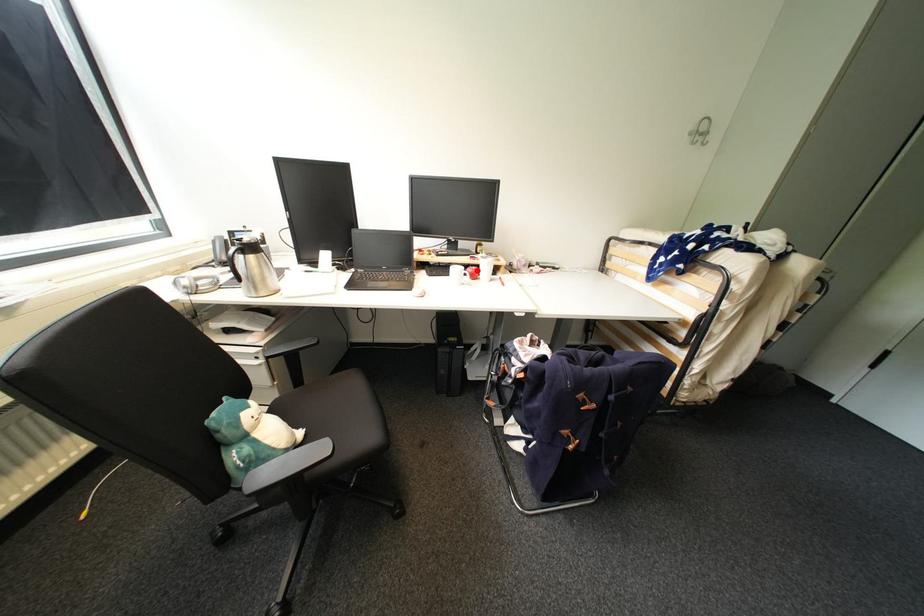
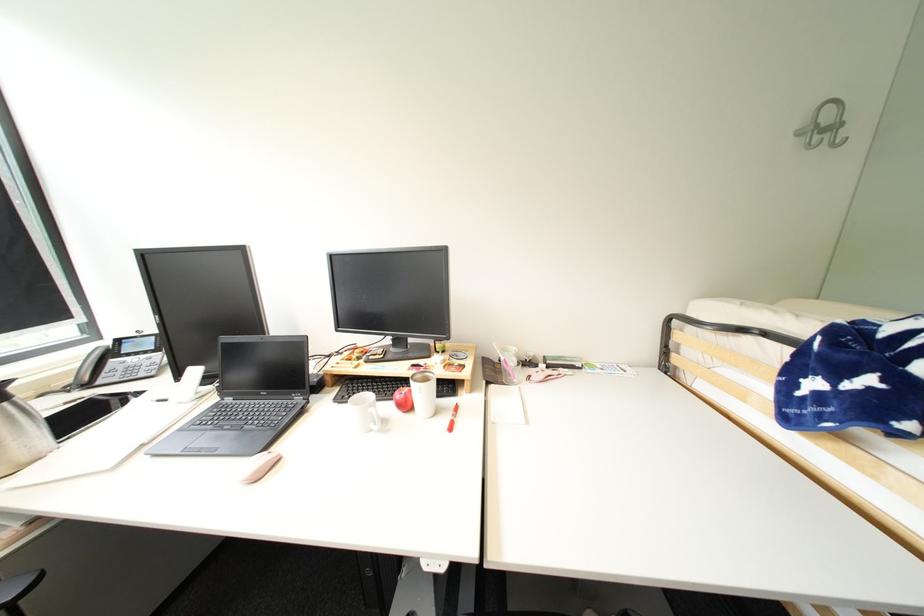
Question: I am providing you with two images of the same scene from different viewpoints. Image1 has a red point marked. In image2, the corresponding 3D location appears at what relative position? Reply with the corresponding letter.

Choices:
 (A) Closer
 (B) Farther

Answer: (B)